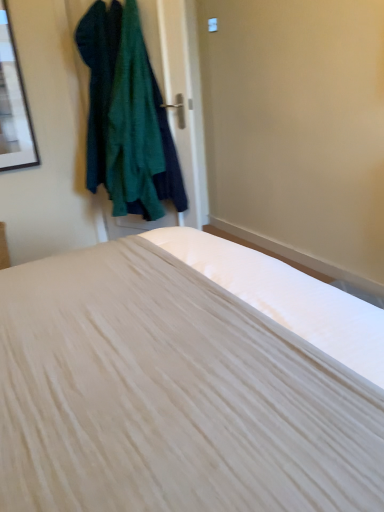
What do you see at coordinates (126, 116) in the screenshot? Image resolution: width=384 pixels, height=512 pixels. I see `dark green textured sweater at upper left, marked as the 1th clothing in a right-to-left arrangement` at bounding box center [126, 116].

What do you see at coordinates (99, 80) in the screenshot? I see `dark green textured sweater at upper left, which ranks as the first clothing in left-to-right order` at bounding box center [99, 80].

Identify the location of matte black picture frame at upper left. (13, 105).

Considering the points (95, 128) and (29, 166), which point is behind, point (95, 128) or point (29, 166)?

The point (29, 166) is farther.

Considering the positions of objects dark green textured sweater at upper left, marked as the 1th clothing in a right-to-left arrangement, and matte black picture frame at upper left in the image provided, who is in front, dark green textured sweater at upper left, marked as the 1th clothing in a right-to-left arrangement, or matte black picture frame at upper left?

Positioned in front is dark green textured sweater at upper left, marked as the 1th clothing in a right-to-left arrangement.

From the image's perspective, which one is positioned higher, dark green textured sweater at upper left, marked as the 1th clothing in a right-to-left arrangement, or matte black picture frame at upper left?

matte black picture frame at upper left is shown above in the image.

Considering the sizes of dark green textured sweater at upper left, marked as the 1th clothing in a right-to-left arrangement, and dark green textured sweater at upper left, which ranks as the first clothing in left-to-right order, in the image, is dark green textured sweater at upper left, marked as the 1th clothing in a right-to-left arrangement, taller or shorter than dark green textured sweater at upper left, which ranks as the first clothing in left-to-right order,?

Considering their sizes, dark green textured sweater at upper left, marked as the 1th clothing in a right-to-left arrangement, has more height than dark green textured sweater at upper left, which ranks as the first clothing in left-to-right order.

Consider the image. Can you confirm if dark green textured sweater at upper left, which ranks as the second clothing in left-to-right order, is wider than dark green textured sweater at upper left, which ranks as the first clothing in left-to-right order?

Yes, dark green textured sweater at upper left, which ranks as the second clothing in left-to-right order, is wider than dark green textured sweater at upper left, which ranks as the first clothing in left-to-right order.

Is the depth of dark green textured sweater at upper left, which ranks as the second clothing in left-to-right order, greater than that of dark green textured sweater at upper left, which ranks as the first clothing in left-to-right order?

No, it is in front of dark green textured sweater at upper left, which ranks as the first clothing in left-to-right order.

Does dark green textured sweater at upper left, which ranks as the second clothing in left-to-right order, contain dark green textured sweater at upper left, which ranks as the first clothing in left-to-right order?

That's correct, dark green textured sweater at upper left, which ranks as the first clothing in left-to-right order, is inside dark green textured sweater at upper left, which ranks as the second clothing in left-to-right order.

Is point (95, 77) positioned behind point (14, 66)?

Yes, point (95, 77) is farther from viewer.

From the picture: Can you tell me how much dark green textured sweater at upper left, which appears as the second clothing when viewed from the right, and matte black picture frame at upper left differ in facing direction?

69.3 degrees.

Can you confirm if dark green textured sweater at upper left, which appears as the second clothing when viewed from the right, is positioned to the left of matte black picture frame at upper left?

No.

Is dark green textured sweater at upper left, which appears as the second clothing when viewed from the right, smaller than matte black picture frame at upper left?

No, dark green textured sweater at upper left, which appears as the second clothing when viewed from the right, is not smaller than matte black picture frame at upper left.

Looking at this image, considering the sizes of objects matte black picture frame at upper left and white matte bed at center in the image provided, who is smaller, matte black picture frame at upper left or white matte bed at center?

matte black picture frame at upper left.

Between matte black picture frame at upper left and white matte bed at center, which one has more height?

matte black picture frame at upper left is taller.

You are a GUI agent. You are given a task and a screenshot of the screen. Output one action in this format:
    pyautogui.click(x=<x>, y=<y>)
    Task: Click on the bed in front of the matte black picture frame at upper left
    
    Given the screenshot: What is the action you would take?
    pyautogui.click(x=186, y=382)

Can you tell me how much matte black picture frame at upper left and white matte bed at center differ in facing direction?

The angle between the facing direction of matte black picture frame at upper left and the facing direction of white matte bed at center is 90.9 degrees.

Is dark green textured sweater at upper left, which ranks as the first clothing in left-to-right order, not within white matte bed at center?

Absolutely, dark green textured sweater at upper left, which ranks as the first clothing in left-to-right order, is external to white matte bed at center.

Is dark green textured sweater at upper left, which ranks as the first clothing in left-to-right order, aimed at white matte bed at center?

No, dark green textured sweater at upper left, which ranks as the first clothing in left-to-right order, is not aimed at white matte bed at center.

From a real-world perspective, is dark green textured sweater at upper left, which ranks as the first clothing in left-to-right order, above or below white matte bed at center?

dark green textured sweater at upper left, which ranks as the first clothing in left-to-right order, is situated higher than white matte bed at center in the real world.

At what (x,y) coordinates should I click in order to perform the action: click on bed on the right of dark green textured sweater at upper left, which appears as the second clothing when viewed from the right. Please return your answer as a coordinate pair (x, y). The height and width of the screenshot is (512, 384). Looking at the image, I should click on pyautogui.click(x=186, y=382).

Between matte black picture frame at upper left and dark green textured sweater at upper left, which appears as the second clothing when viewed from the right, which one has larger width?

Wider between the two is dark green textured sweater at upper left, which appears as the second clothing when viewed from the right.

From the image's perspective, which is above, matte black picture frame at upper left or dark green textured sweater at upper left, which appears as the second clothing when viewed from the right?

From the image's view, dark green textured sweater at upper left, which appears as the second clothing when viewed from the right, is above.

Does matte black picture frame at upper left touch dark green textured sweater at upper left, which ranks as the first clothing in left-to-right order?

No, matte black picture frame at upper left is not next to dark green textured sweater at upper left, which ranks as the first clothing in left-to-right order.

From a real-world perspective, who is located higher, matte black picture frame at upper left or dark green textured sweater at upper left, which appears as the second clothing when viewed from the right?

In real-world perspective, dark green textured sweater at upper left, which appears as the second clothing when viewed from the right, is above.

Measure the distance between white matte bed at center and dark green textured sweater at upper left, which ranks as the first clothing in left-to-right order.

white matte bed at center is 5.29 feet from dark green textured sweater at upper left, which ranks as the first clothing in left-to-right order.

Would you consider white matte bed at center to be distant from dark green textured sweater at upper left, which appears as the second clothing when viewed from the right?

Yes, white matte bed at center and dark green textured sweater at upper left, which appears as the second clothing when viewed from the right, are located far from each other.

Can you confirm if white matte bed at center is shorter than dark green textured sweater at upper left, which appears as the second clothing when viewed from the right?

In fact, white matte bed at center may be taller than dark green textured sweater at upper left, which appears as the second clothing when viewed from the right.

Is white matte bed at center facing towards dark green textured sweater at upper left, which ranks as the first clothing in left-to-right order?

No.

Where is `picture frame on the left of dark green textured sweater at upper left, which ranks as the second clothing in left-to-right order`? picture frame on the left of dark green textured sweater at upper left, which ranks as the second clothing in left-to-right order is located at coordinates (13, 105).

Find the location of `clothing behind the dark green textured sweater at upper left, which ranks as the second clothing in left-to-right order`. clothing behind the dark green textured sweater at upper left, which ranks as the second clothing in left-to-right order is located at coordinates (99, 80).

Considering their positions, is dark green textured sweater at upper left, which appears as the second clothing when viewed from the right, positioned further to dark green textured sweater at upper left, marked as the 1th clothing in a right-to-left arrangement, than white matte bed at center?

Based on the image, white matte bed at center appears to be further to dark green textured sweater at upper left, marked as the 1th clothing in a right-to-left arrangement.

Which object lies further to the anchor point white matte bed at center, dark green textured sweater at upper left, which ranks as the first clothing in left-to-right order, or dark green textured sweater at upper left, marked as the 1th clothing in a right-to-left arrangement?

dark green textured sweater at upper left, which ranks as the first clothing in left-to-right order, is positioned further to the anchor white matte bed at center.

From the image, which object appears to be farther from white matte bed at center, matte black picture frame at upper left or dark green textured sweater at upper left, marked as the 1th clothing in a right-to-left arrangement?

Based on the image, matte black picture frame at upper left appears to be further to white matte bed at center.

Considering their positions, is dark green textured sweater at upper left, which ranks as the second clothing in left-to-right order, positioned closer to matte black picture frame at upper left than white matte bed at center?

dark green textured sweater at upper left, which ranks as the second clothing in left-to-right order.

Which object lies further to the anchor point white matte bed at center, matte black picture frame at upper left or dark green textured sweater at upper left, which appears as the second clothing when viewed from the right?

Based on the image, matte black picture frame at upper left appears to be further to white matte bed at center.

Estimate the real-world distances between objects in this image. Which object is further from dark green textured sweater at upper left, which ranks as the first clothing in left-to-right order, matte black picture frame at upper left or white matte bed at center?

white matte bed at center is further to dark green textured sweater at upper left, which ranks as the first clothing in left-to-right order.

When comparing their distances from white matte bed at center, does dark green textured sweater at upper left, which ranks as the second clothing in left-to-right order, or dark green textured sweater at upper left, which appears as the second clothing when viewed from the right, seem closer?

Among the two, dark green textured sweater at upper left, which ranks as the second clothing in left-to-right order, is located nearer to white matte bed at center.

Estimate the real-world distances between objects in this image. Which object is further from matte black picture frame at upper left, white matte bed at center or dark green textured sweater at upper left, marked as the 1th clothing in a right-to-left arrangement?

white matte bed at center is positioned further to the anchor matte black picture frame at upper left.

You are a GUI agent. You are given a task and a screenshot of the screen. Output one action in this format:
    pyautogui.click(x=<x>, y=<y>)
    Task: Click on the clothing between white matte bed at center and dark green textured sweater at upper left, which ranks as the first clothing in left-to-right order, along the z-axis
    The image size is (384, 512).
    Given the screenshot: What is the action you would take?
    pyautogui.click(x=126, y=116)

I want to click on clothing located between matte black picture frame at upper left and dark green textured sweater at upper left, marked as the 1th clothing in a right-to-left arrangement, in the left-right direction, so click(99, 80).